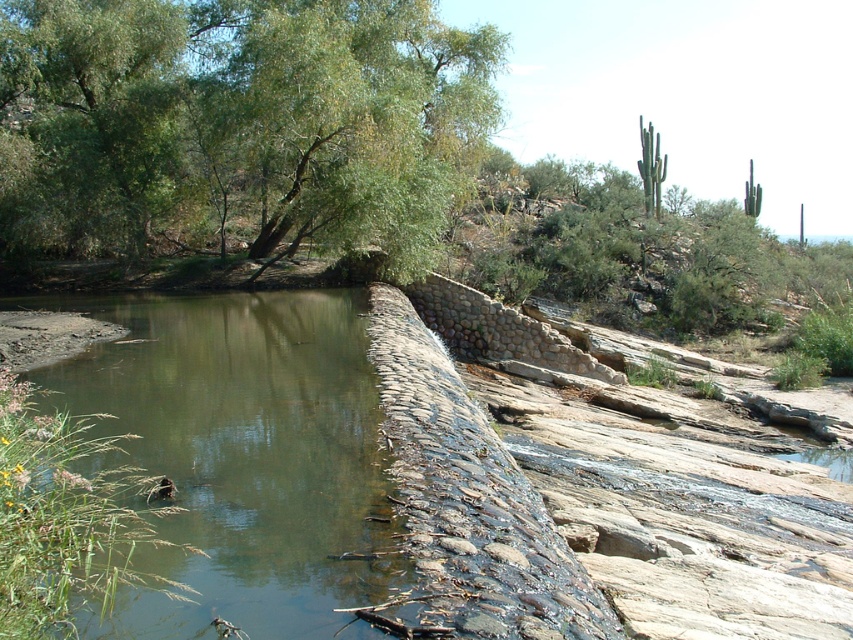
Question: Does green leafy tree at upper left have a lesser width compared to greenish-brown stone river at lower left?

Choices:
 (A) yes
 (B) no

Answer: (B)

Question: Among these points, which one is nearest to the camera?

Choices:
 (A) (343, 308)
 (B) (437, 224)

Answer: (A)

Question: Which point is farther from the camera taking this photo?

Choices:
 (A) (373, 506)
 (B) (380, 97)

Answer: (B)

Question: Is green leafy tree at upper left above greenish-brown stone river at lower left?

Choices:
 (A) no
 (B) yes

Answer: (B)

Question: Can you confirm if green leafy tree at upper left is positioned to the left of greenish-brown stone river at lower left?

Choices:
 (A) no
 (B) yes

Answer: (B)